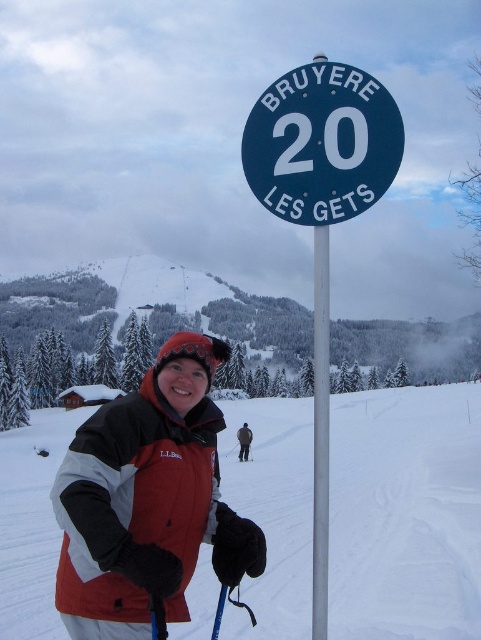
You are a photographer standing at the base of the mountain. You want to take a photo of both the metallic pole at center and the black matte ski at center in the same frame. Based on their sizes, which object will appear larger in the photo?

The metallic pole at center is much taller than the black matte ski at center, so it will appear larger in the photo.